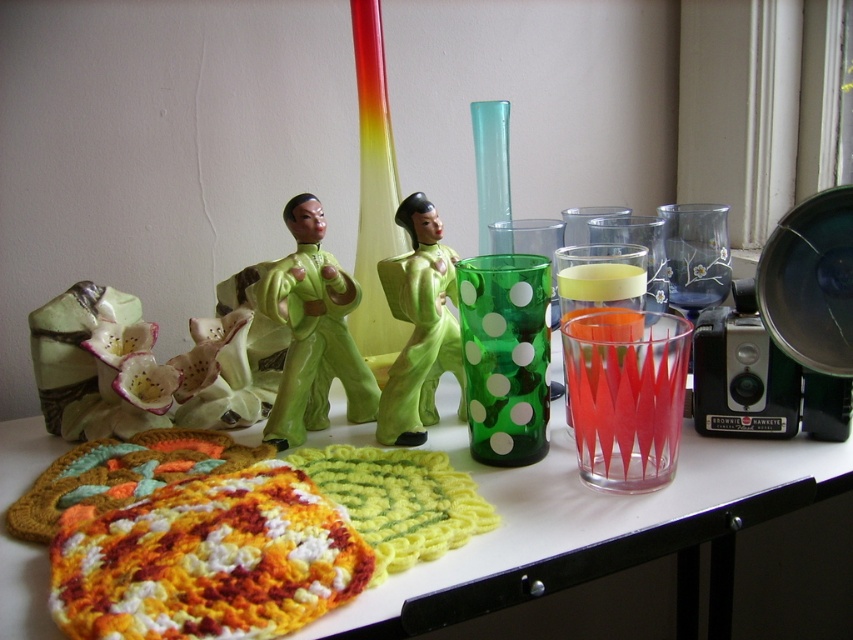
You are holding a camera and want to take a photo of the translucent red glass at center right. If your camera can focus on objects up to 25 inches away, will it be able to capture a clear image?

The translucent red glass at center right and camera are 24.83 inches apart from each other, which is within the camera focus range of up to 25 inches. Therefore, the camera can capture a clear image of the translucent red glass at center right.

You are holding a camera and want to take a photo of the green matte figure at center. If your camera requires a minimum distance of 30 inches to focus properly, will you need to move further away or closer to achieve focus?

The green matte figure at center and camera are 29.41 inches apart. Since the required minimum distance is 30 inches, you need to move the camera slightly further away to meet the focusing requirement.

You are organizing a display and need to know the relative heights of the translucent red glass at center right and the green glossy figurine at center. Which object is shorter?

The translucent red glass at center right is shorter than the green glossy figurine at center.